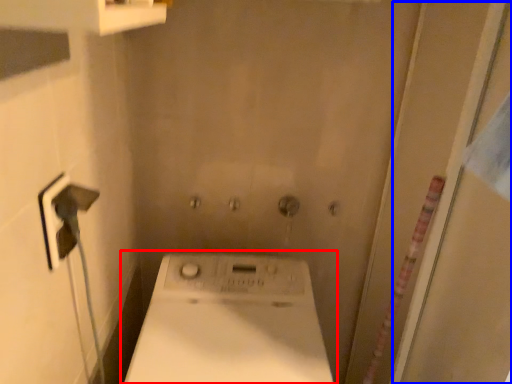
Question: Which object appears closest to the camera in this image, washing machine (highlighted by a red box) or screen door (highlighted by a blue box)?

Choices:
 (A) washing machine
 (B) screen door

Answer: (B)